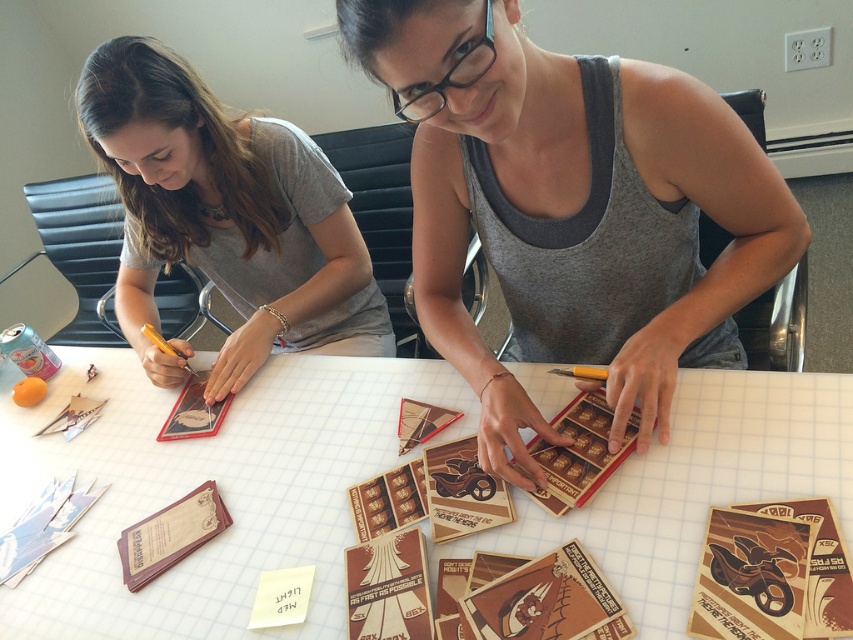
At what (x,y) coordinates should I click in order to perform the action: click on white grid paper at center. Please return your answer as a coordinate pair (x, y). The height and width of the screenshot is (640, 853). Looking at the image, I should click on (218, 486).

Which is more to the right, white grid paper at center or matte gray shirt at upper left?

white grid paper at center

Image resolution: width=853 pixels, height=640 pixels. Identify the location of white grid paper at center. (218, 486).

The width and height of the screenshot is (853, 640). What are the coordinates of `white grid paper at center` in the screenshot? It's located at (218, 486).

Looking at this image, is gray tank top at center shorter than matte gray shirt at upper left?

Indeed, gray tank top at center has a lesser height compared to matte gray shirt at upper left.

Does gray tank top at center appear on the right side of matte gray shirt at upper left?

Correct, you'll find gray tank top at center to the right of matte gray shirt at upper left.

Which is in front, point (639, 196) or point (146, 120)?

Point (639, 196) is more forward.

Locate an element on the screen. This screenshot has width=853, height=640. gray tank top at center is located at coordinates (570, 204).

Who is lower down, white grid paper at center or gray tank top at center?

white grid paper at center is lower down.

Does point (704, 509) lie behind point (437, 173)?

No, it is in front of (437, 173).

Is point (659, 483) in front of point (523, 408)?

Yes, it is in front of point (523, 408).

Identify the location of white grid paper at center. (218, 486).